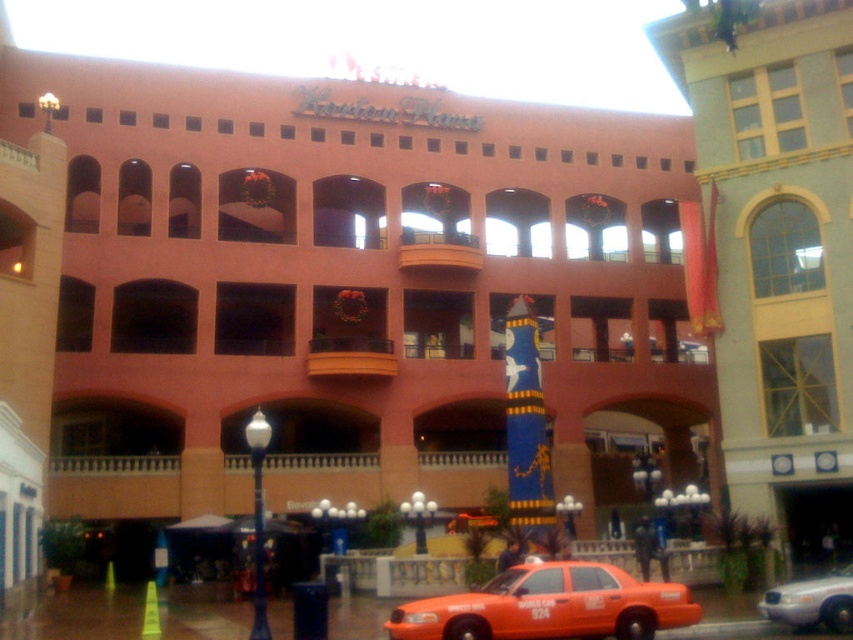
Question: Which of the following is the farthest from the observer?

Choices:
 (A) (792, 625)
 (B) (830, 502)
 (C) (325, 214)

Answer: (C)

Question: Does matte orange taxi at lower center appear on the right side of metallic silver car at lower right?

Choices:
 (A) yes
 (B) no

Answer: (B)

Question: Which point is closer to the camera taking this photo?

Choices:
 (A) (184, 321)
 (B) (778, 611)

Answer: (B)

Question: Does orange matte taxi at lower center have a lesser width compared to metallic silver car at lower right?

Choices:
 (A) yes
 (B) no

Answer: (B)

Question: Among these objects, which one is nearest to the camera?

Choices:
 (A) yellow textured building at right
 (B) metallic silver car at lower right
 (C) matte orange taxi at lower center

Answer: (B)

Question: Is orange matte taxi at lower center bigger than metallic silver car at lower right?

Choices:
 (A) no
 (B) yes

Answer: (B)